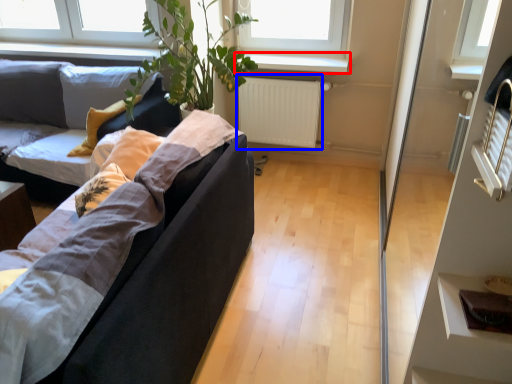
Question: Among these objects, which one is farthest to the camera, window sill (highlighted by a red box) or radiator (highlighted by a blue box)?

Choices:
 (A) window sill
 (B) radiator

Answer: (B)